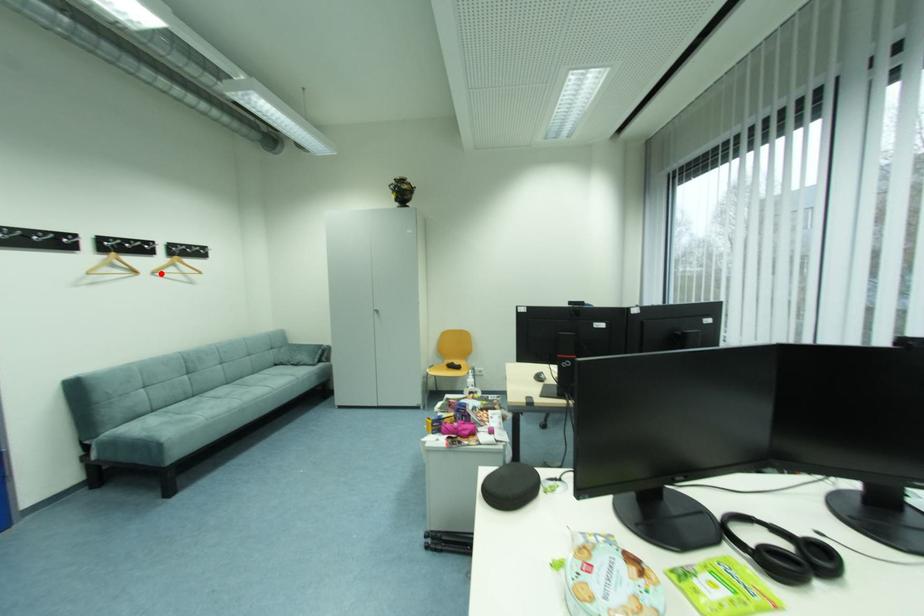
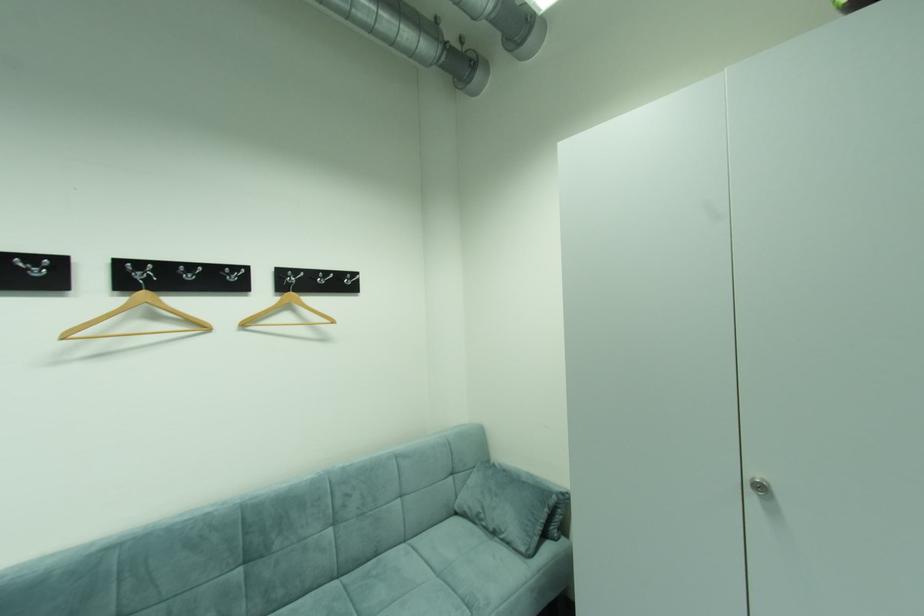
Locate, in the second image, the point that corresponds to the highlighted location in the first image.

(251, 326)